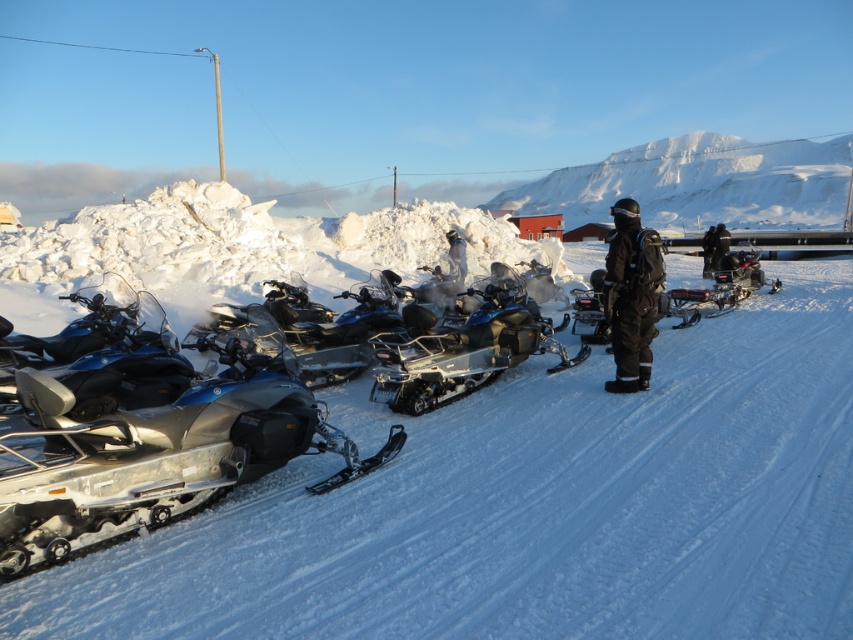
Question: Which point appears farthest from the camera in this image?

Choices:
 (A) (637, 275)
 (B) (218, 342)
 (C) (457, 381)

Answer: (B)

Question: Where is metallic blue snowmobile at center-left located in relation to black matte snowsuit at center in the image?

Choices:
 (A) below
 (B) above

Answer: (A)

Question: Can you confirm if white powdery snow at center is positioned to the left of black matte snowsuit at center?

Choices:
 (A) yes
 (B) no

Answer: (B)

Question: Which of the following is the farthest from the observer?

Choices:
 (A) white powdery snow at center
 (B) metallic blue snowmobile at center-left

Answer: (B)

Question: Is metallic blue snowmobile at center-left positioned in front of black matte snowsuit at center?

Choices:
 (A) yes
 (B) no

Answer: (A)

Question: Which of these objects is positioned closest to the metallic blue snowmobile at center-left?

Choices:
 (A) shiny metallic snowmobile at center
 (B) white powdery snow at center

Answer: (B)